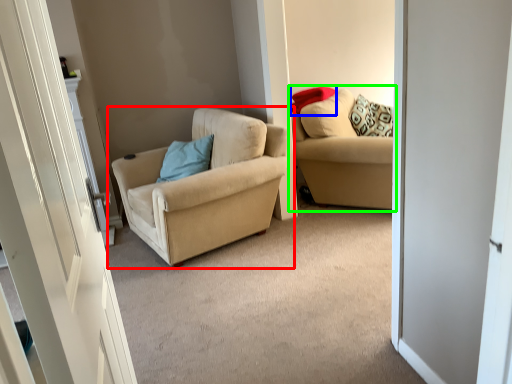
Question: Estimate the real-world distances between objects in this image. Which object is farther from chair (highlighted by a red box), pillow (highlighted by a blue box) or studio couch (highlighted by a green box)?

Choices:
 (A) pillow
 (B) studio couch

Answer: (A)